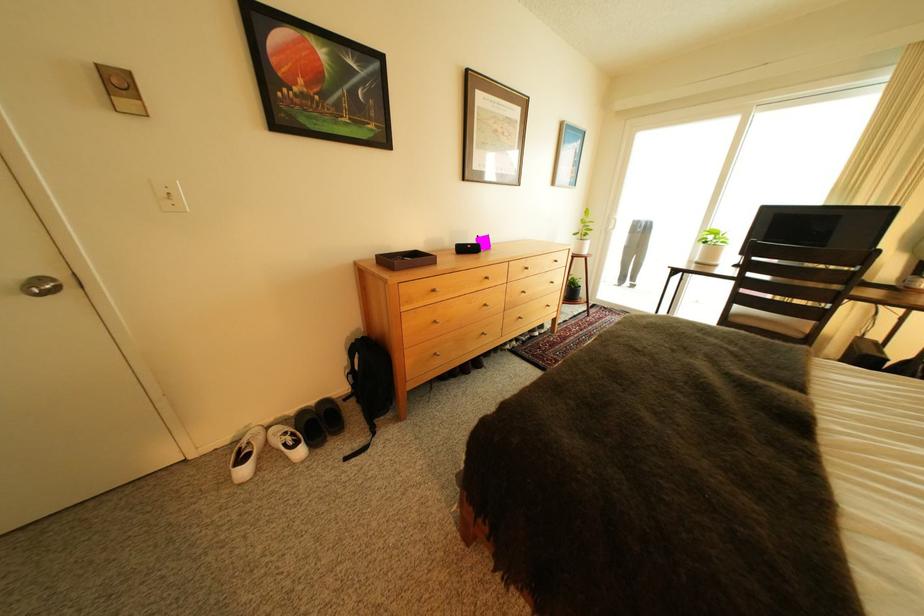
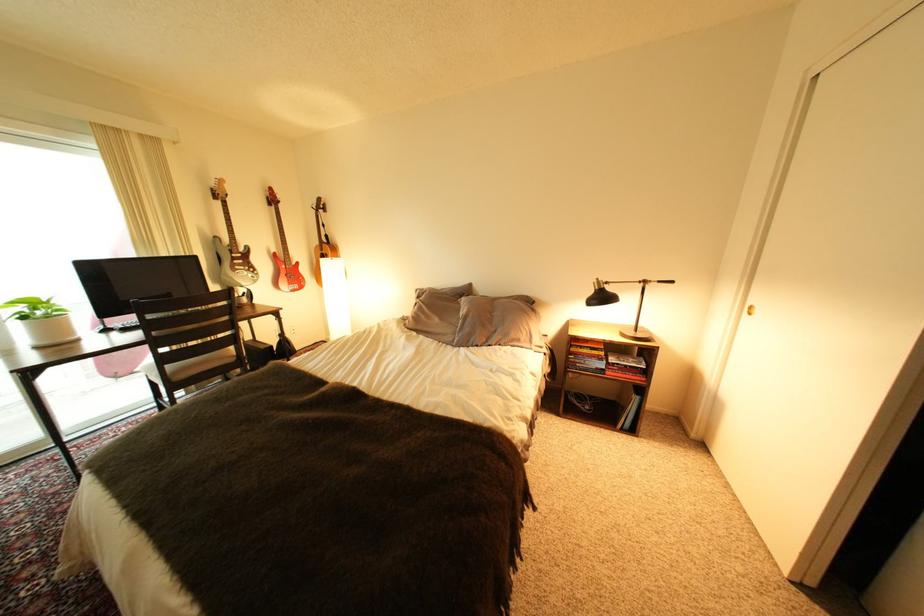
Find the pixel in the second image that matches (718,244) in the first image.

(37, 318)